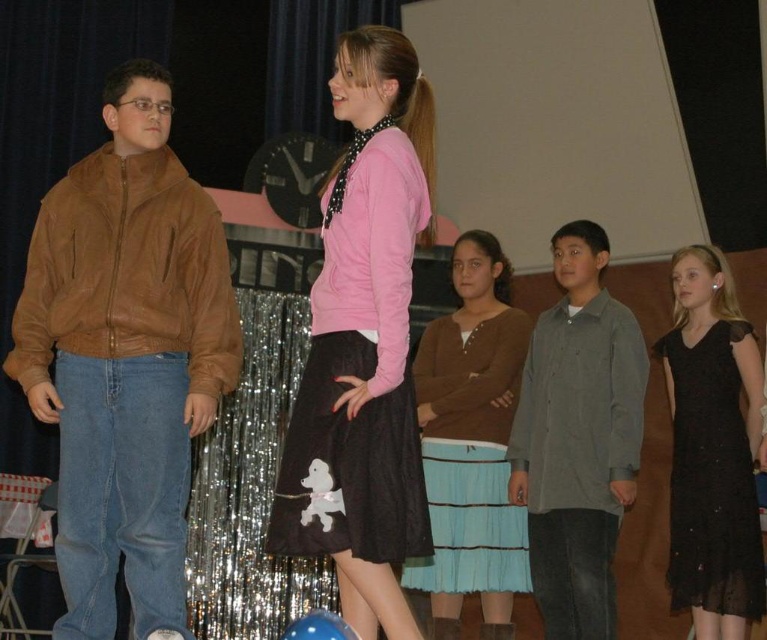
Is point (147, 625) positioned behind point (430, 541)?

Yes, it is behind point (430, 541).

Identify the location of brown leather jacket at left. The image size is (767, 640). click(x=124, y=356).

Does pink matte sweater at center have a smaller size compared to blue glossy balloon at lower center?

Incorrect, pink matte sweater at center is not smaller in size than blue glossy balloon at lower center.

Is pink matte sweater at center in front of blue glossy balloon at lower center?

No.

Is point (410, 234) positioned in front of point (281, 636)?

Yes, it is in front of point (281, 636).

Locate an element on the screen. pink matte sweater at center is located at coordinates (364, 346).

Is gray cotton shirt at center below black lace dress at right?

Incorrect, gray cotton shirt at center is not positioned below black lace dress at right.

Who is positioned more to the right, gray cotton shirt at center or black lace dress at right?

From the viewer's perspective, black lace dress at right appears more on the right side.

Where is `gray cotton shirt at center`? gray cotton shirt at center is located at coordinates (578, 438).